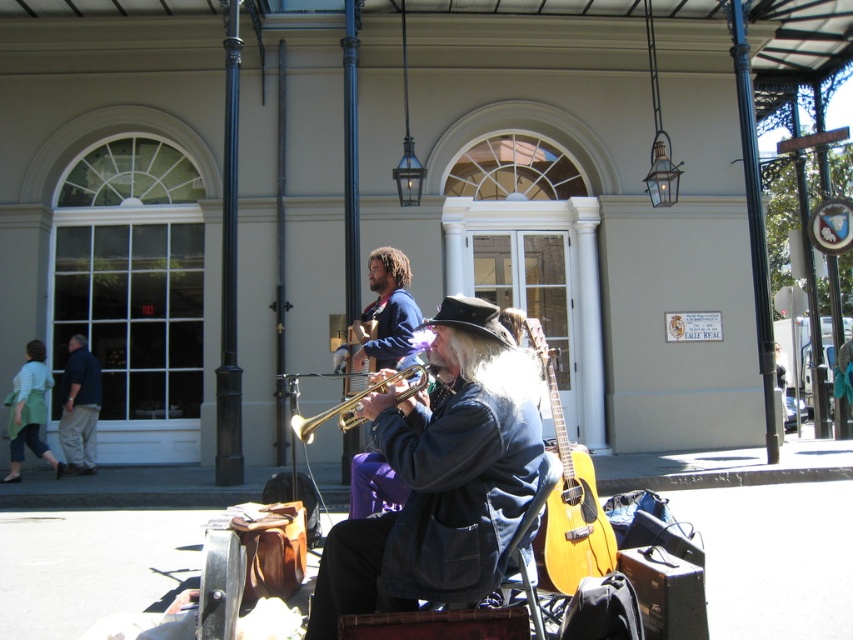
Question: Which object is the closest to the acoustic wood guitar at center?

Choices:
 (A) gold shiny trumpet at center
 (B) dark blue shirt at left
 (C) denim jacket at center

Answer: (C)

Question: Which point is closer to the camera?

Choices:
 (A) denim jacket at center
 (B) gold shiny trumpet at center

Answer: (A)

Question: Where is acoustic wood guitar at center located in relation to purple fabric pants at center in the image?

Choices:
 (A) above
 (B) below

Answer: (B)

Question: Can you confirm if denim jacket at center is positioned above gold shiny trumpet at center?

Choices:
 (A) yes
 (B) no

Answer: (B)

Question: Which of the following is the closest to the observer?

Choices:
 (A) dark blue shirt at left
 (B) acoustic wood guitar at center
 (C) denim jacket at center

Answer: (C)

Question: Can you confirm if purple fabric pants at center is bigger than dark blue shirt at left?

Choices:
 (A) yes
 (B) no

Answer: (A)